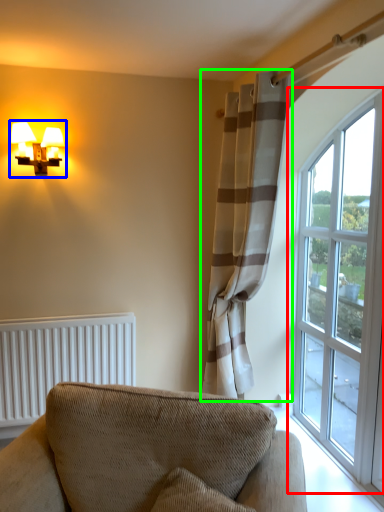
Question: Estimate the real-world distances between objects in this image. Which object is farther from window (highlighted by a red box), table lamp (highlighted by a blue box) or curtain (highlighted by a green box)?

Choices:
 (A) table lamp
 (B) curtain

Answer: (A)